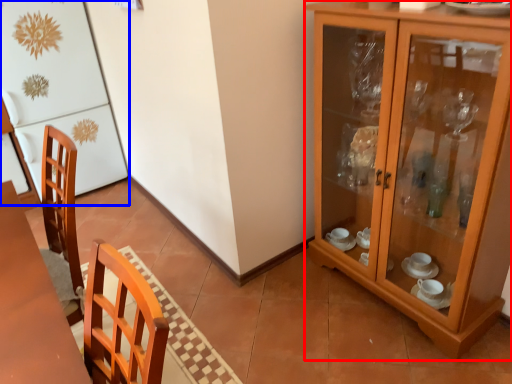
Question: Which of the following is the farthest to the observer, cabinetry (highlighted by a red box) or fridge (highlighted by a blue box)?

Choices:
 (A) cabinetry
 (B) fridge

Answer: (B)